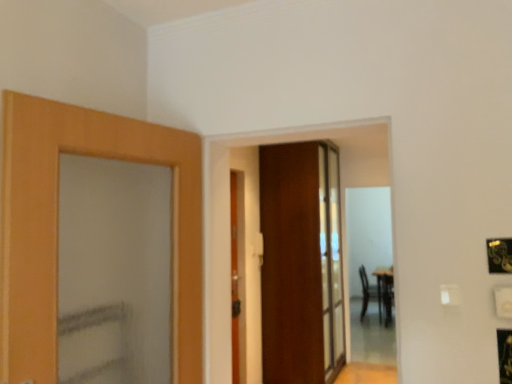
Question: Is wooden door at center, the 2th door from the left, at the back of wooden door at center, placed as the 2th door when sorted from back to front?

Choices:
 (A) yes
 (B) no

Answer: (B)

Question: Does wooden door at center, acting as the 2th door starting from the right, have a lesser width compared to wooden door at center, which ranks as the first door in back-to-front order?

Choices:
 (A) no
 (B) yes

Answer: (B)

Question: From the image's perspective, is wooden door at center, acting as the 2th door starting from the right, over wooden door at center, acting as the 2th door starting from the front?

Choices:
 (A) yes
 (B) no

Answer: (B)

Question: From a real-world perspective, is wooden door at center, placed as the 2th door when sorted from back to front, on top of wooden door at center, acting as the 2th door starting from the front?

Choices:
 (A) yes
 (B) no

Answer: (B)

Question: Does wooden door at center, acting as the 1th door starting from the front, lie behind wooden door at center, which ranks as the first door in back-to-front order?

Choices:
 (A) yes
 (B) no

Answer: (B)

Question: Can you confirm if wooden door at center, acting as the 1th door starting from the front, is smaller than wooden door at center, which ranks as the first door in back-to-front order?

Choices:
 (A) no
 (B) yes

Answer: (B)

Question: Considering the relative positions of wooden door at center, which ranks as the first door in back-to-front order, and wooden door at center, acting as the 2th door starting from the right, in the image provided, is wooden door at center, which ranks as the first door in back-to-front order, to the right of wooden door at center, acting as the 2th door starting from the right, from the viewer's perspective?

Choices:
 (A) yes
 (B) no

Answer: (A)

Question: Can you confirm if wooden door at center, which ranks as the first door in back-to-front order, is shorter than wooden door at center, acting as the 1th door starting from the front?

Choices:
 (A) yes
 (B) no

Answer: (B)

Question: Is wooden door at center, the 2th door from the left, beside wooden door at center, acting as the 1th door starting from the front?

Choices:
 (A) yes
 (B) no

Answer: (B)

Question: From the image's perspective, is wooden door at center, which ranks as the first door in back-to-front order, over wooden door at center, which ranks as the first door in left-to-right order?

Choices:
 (A) no
 (B) yes

Answer: (B)

Question: From the image's perspective, is wooden door at center, acting as the 2th door starting from the front, under wooden door at center, acting as the 1th door starting from the front?

Choices:
 (A) yes
 (B) no

Answer: (B)

Question: Is wooden door at center, the 2th door from the left, oriented towards wooden door at center, which ranks as the first door in left-to-right order?

Choices:
 (A) yes
 (B) no

Answer: (B)

Question: Is wooden door at center, the 2th door from the left, in front of black leather armchair at right?

Choices:
 (A) no
 (B) yes

Answer: (B)